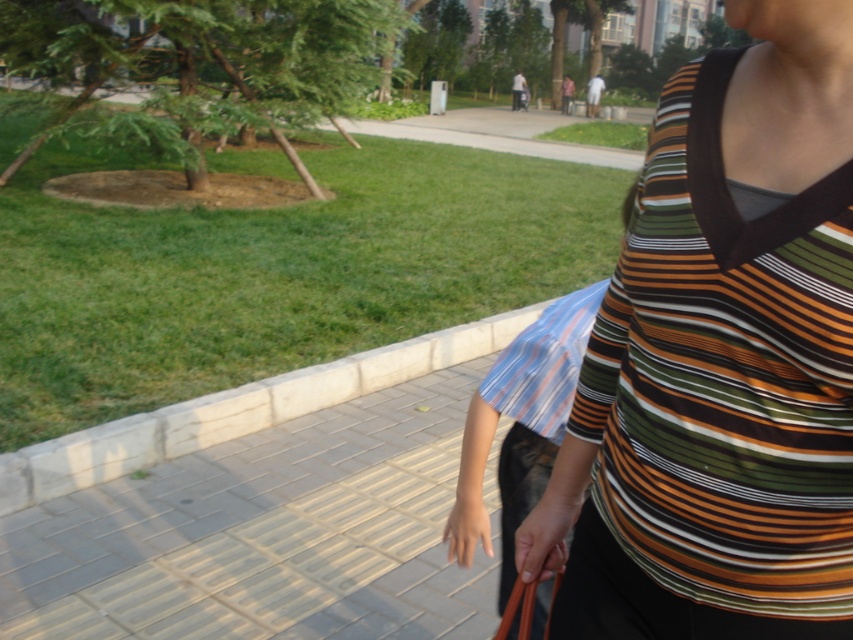
Question: Does striped cotton shirt at right have a smaller size compared to gray brick pavement at center?

Choices:
 (A) no
 (B) yes

Answer: (B)

Question: Which point is farther from the camera taking this photo?

Choices:
 (A) [131, 566]
 (B) [641, 193]

Answer: (A)

Question: Which of the following is the closest to the observer?

Choices:
 (A) striped cotton shirt at right
 (B) gray brick pavement at center

Answer: (A)

Question: Is striped cotton shirt at right positioned at the back of gray brick pavement at center?

Choices:
 (A) yes
 (B) no

Answer: (B)

Question: Is striped cotton shirt at right positioned before gray brick pavement at center?

Choices:
 (A) yes
 (B) no

Answer: (A)